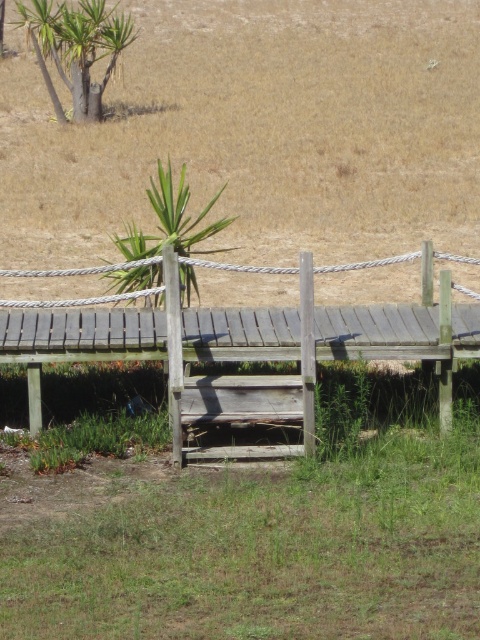
Question: Which of the following is the farthest from the observer?

Choices:
 (A) brown grassy field at center
 (B) green leafy plant at upper left
 (C) green grassy at lower center
 (D) weathered wood bridge at center

Answer: (B)

Question: Is green grassy at lower center positioned at the back of green leafy plant at upper left?

Choices:
 (A) yes
 (B) no

Answer: (B)

Question: Can you confirm if green grassy at lower center is positioned to the right of green leafy plant at center?

Choices:
 (A) no
 (B) yes

Answer: (B)

Question: Which point is closer to the camera?

Choices:
 (A) (45, 168)
 (B) (154, 305)

Answer: (B)

Question: Is green grassy at lower center bigger than green leafy plant at center?

Choices:
 (A) yes
 (B) no

Answer: (B)

Question: Which object is the farthest from the green grassy at lower center?

Choices:
 (A) brown grassy field at center
 (B) weathered wood bridge at center
 (C) green leafy plant at upper left

Answer: (C)